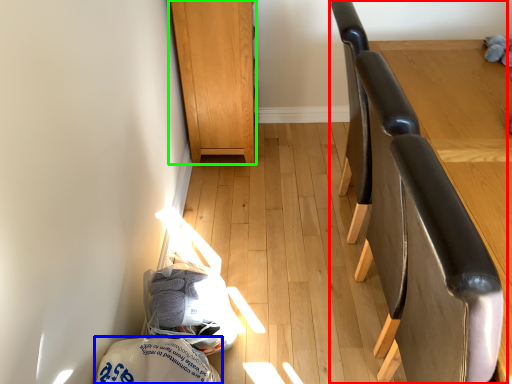
Question: Which is nearer to the chair (highlighted by a red box)? material (highlighted by a blue box) or furniture (highlighted by a green box).

Choices:
 (A) material
 (B) furniture

Answer: (A)